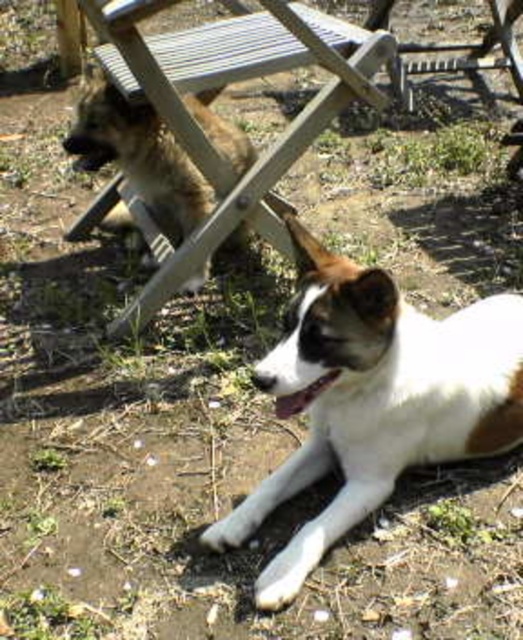
Question: Is white fur dog at lower right thinner than wooden chair at upper center?

Choices:
 (A) yes
 (B) no

Answer: (A)

Question: Which object appears closest to the camera in this image?

Choices:
 (A) white fur dog at lower right
 (B) wooden chair at upper center

Answer: (A)

Question: Can you confirm if white fur dog at lower right is positioned above wooden chair at upper center?

Choices:
 (A) yes
 (B) no

Answer: (B)

Question: Is white fur dog at lower right to the right of wooden chair at upper center from the viewer's perspective?

Choices:
 (A) no
 (B) yes

Answer: (B)

Question: Which point is closer to the camera?

Choices:
 (A) white fur dog at lower right
 (B) wooden chair at upper center

Answer: (A)